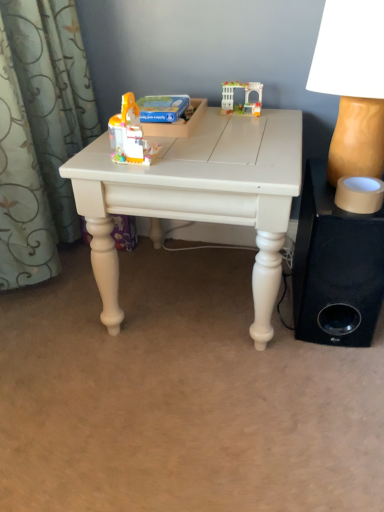
Where is `free point below white matte table at center (from a real-world perspective)`? Image resolution: width=384 pixels, height=512 pixels. free point below white matte table at center (from a real-world perspective) is located at coordinates (194, 290).